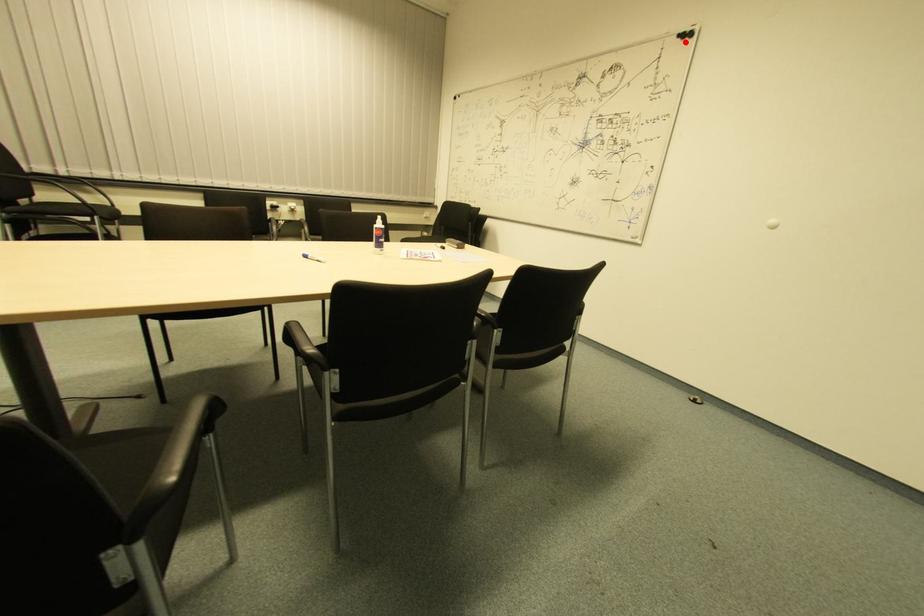
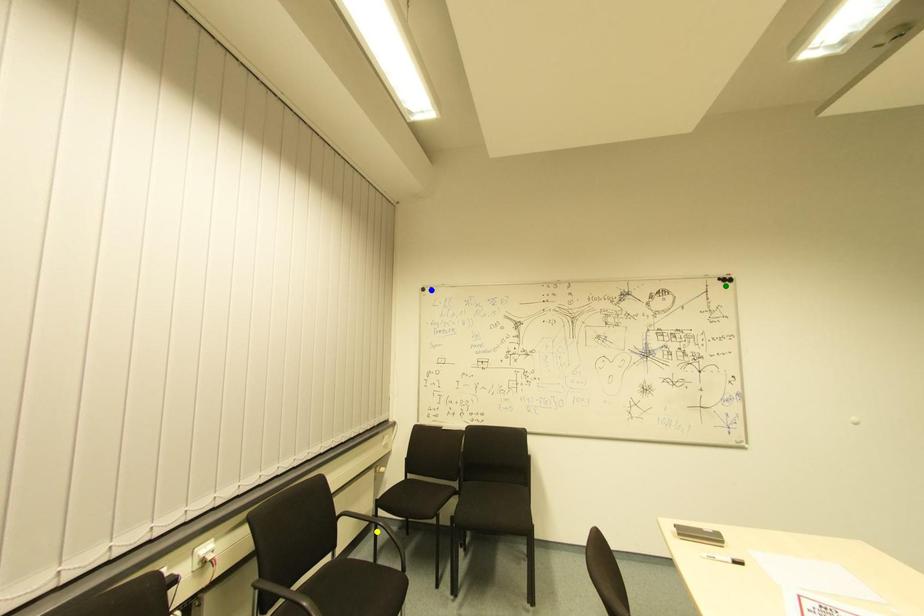
Question: I am providing you with two images of the same scene from different viewpoints. A red point is marked on the first image. You are given multiple points on the second image. Which point in image 2 is actually the same real-world point as the red point in image 1?

Choices:
 (A) blue point
 (B) yellow point
 (C) green point

Answer: (C)